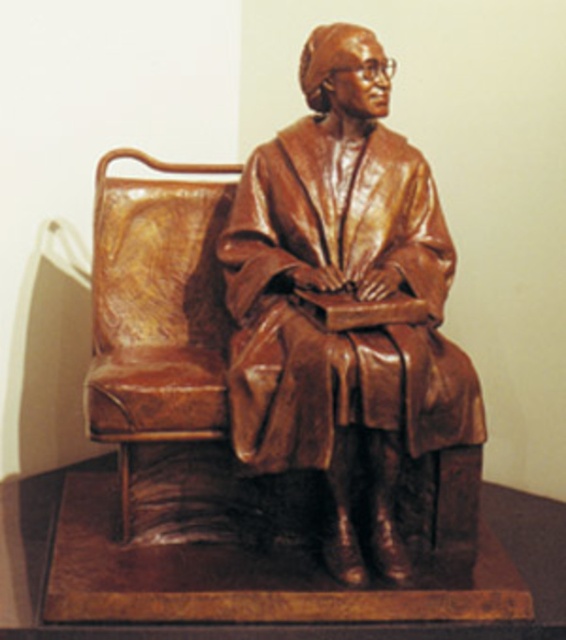
Question: Which point is closer to the camera?

Choices:
 (A) bronze statue at center
 (B) brown leather armchair at left

Answer: (A)

Question: Which of the following is the closest to the observer?

Choices:
 (A) (430, 282)
 (B) (110, 186)

Answer: (A)

Question: Is bronze statue at center closer to camera compared to brown leather armchair at left?

Choices:
 (A) yes
 (B) no

Answer: (A)

Question: Is bronze statue at center thinner than brown leather armchair at left?

Choices:
 (A) yes
 (B) no

Answer: (B)

Question: Does bronze statue at center have a greater width compared to brown leather armchair at left?

Choices:
 (A) yes
 (B) no

Answer: (A)